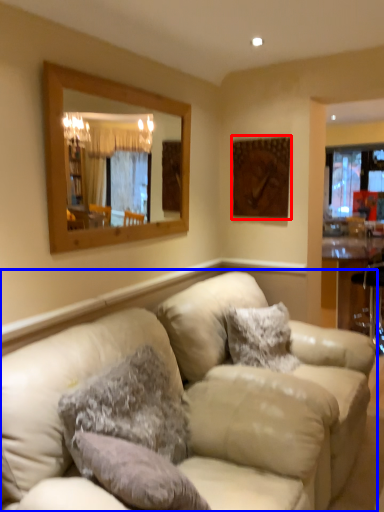
Question: Which object appears closest to the camera in this image, picture frame (highlighted by a red box) or studio couch (highlighted by a blue box)?

Choices:
 (A) picture frame
 (B) studio couch

Answer: (B)